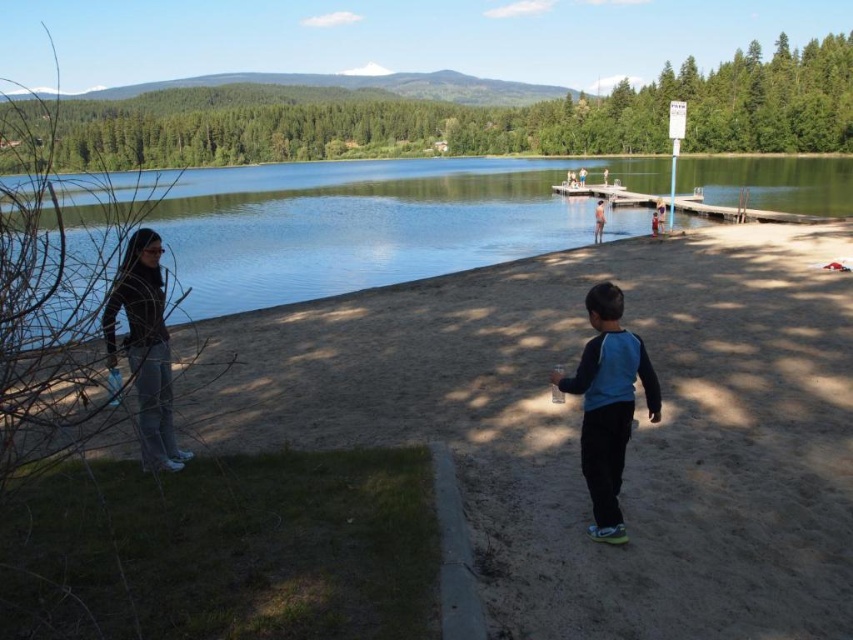
Is blue fabric shirt at center positioned in front of black matte jacket at lower left?

No, it is not.

Based on the photo, who is more distant from viewer, (x=584, y=442) or (x=148, y=253)?

Positioned behind is point (x=148, y=253).

You are a GUI agent. You are given a task and a screenshot of the screen. Output one action in this format:
    pyautogui.click(x=<x>, y=<y>)
    Task: Click on the blue fabric shirt at center
    The width and height of the screenshot is (853, 640).
    Given the screenshot: What is the action you would take?
    pyautogui.click(x=608, y=404)

Can you confirm if brown sandy beach at lower center is thinner than clear water at center?

Yes.

Is brown sandy beach at lower center to the left of clear water at center from the viewer's perspective?

No, brown sandy beach at lower center is not to the left of clear water at center.

Is point (198, 369) positioned before point (271, 212)?

That is True.

Identify the location of brown sandy beach at lower center. Image resolution: width=853 pixels, height=640 pixels. (579, 420).

Who is higher up, brown sandy beach at lower center or blue fabric shirt at center?

Positioned higher is brown sandy beach at lower center.

Image resolution: width=853 pixels, height=640 pixels. What do you see at coordinates (579, 420) in the screenshot?
I see `brown sandy beach at lower center` at bounding box center [579, 420].

Is point (746, 358) farther from camera compared to point (627, 384)?

Yes, it is behind point (627, 384).

Identify the location of brown sandy beach at lower center. Image resolution: width=853 pixels, height=640 pixels. (579, 420).